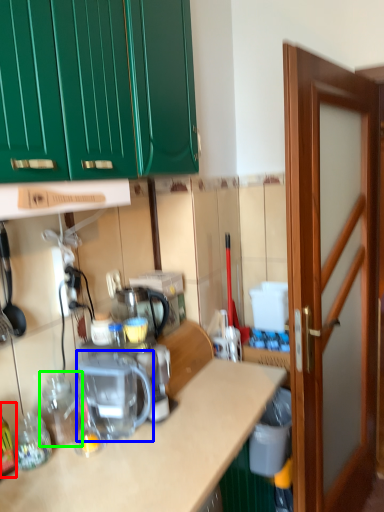
Question: Estimate the real-world distances between objects in this image. Which object is closer to bottle (highlighted by a red box), coffee machine (highlighted by a blue box) or bottle (highlighted by a green box)?

Choices:
 (A) coffee machine
 (B) bottle

Answer: (B)